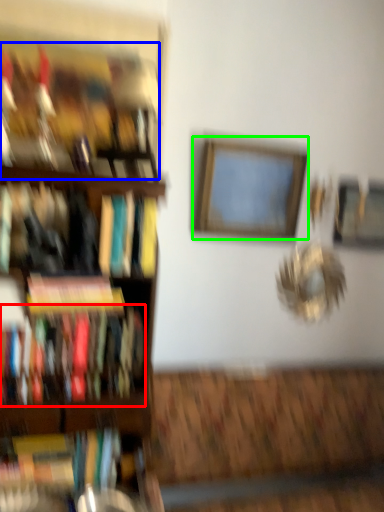
Question: Estimate the real-world distances between objects in this image. Which object is farther from book (highlighted by a red box), book (highlighted by a blue box) or picture frame (highlighted by a green box)?

Choices:
 (A) book
 (B) picture frame

Answer: (B)